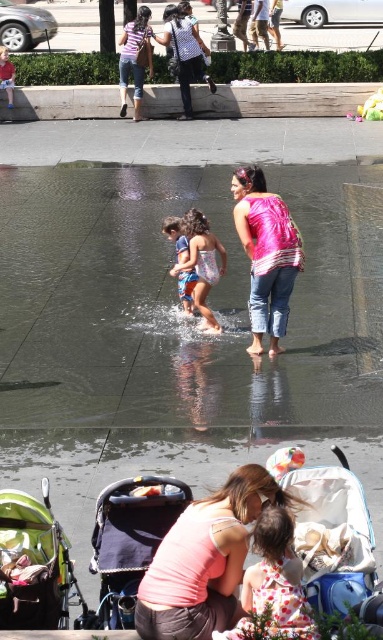
Question: Among these points, which one is nearest to the camera?

Choices:
 (A) (11, 100)
 (B) (250, 218)

Answer: (B)

Question: Is green fabric stroller at lower left thinner than red shirt at lower center?

Choices:
 (A) no
 (B) yes

Answer: (A)

Question: Can you confirm if clear water at center is wider than red shirt at lower center?

Choices:
 (A) yes
 (B) no

Answer: (A)

Question: Is green fabric stroller at lower left below red shirt at lower center?

Choices:
 (A) yes
 (B) no

Answer: (A)

Question: Estimate the real-world distances between objects in this image. Which object is farther from the light blue denim shorts at center?

Choices:
 (A) pink cotton shirt at lower center
 (B) clear water at center
 (C) red shirt at lower center
 (D) blue denim shorts at center

Answer: (C)

Question: Which of the following is the farthest from the observer?

Choices:
 (A) (165, 221)
 (B) (281, 205)

Answer: (A)